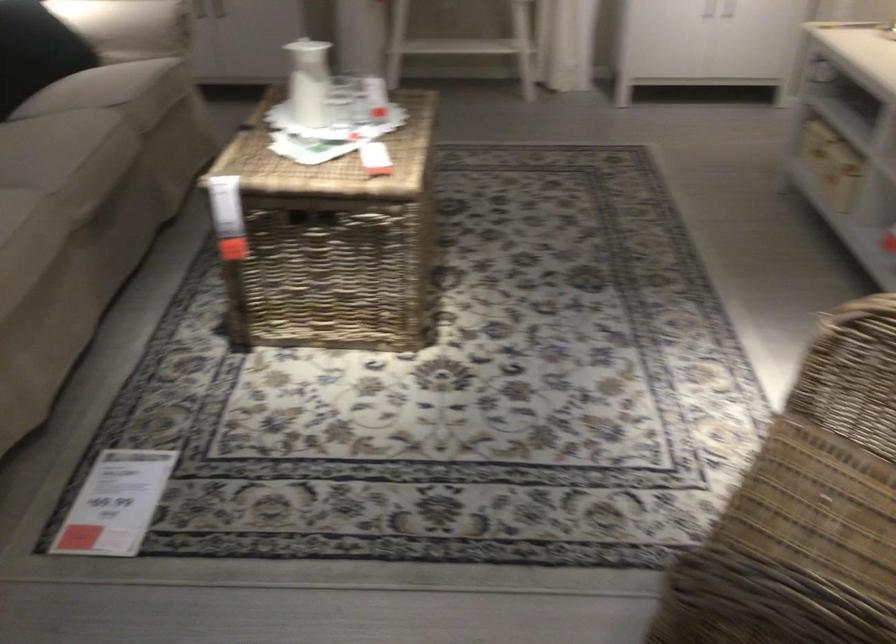
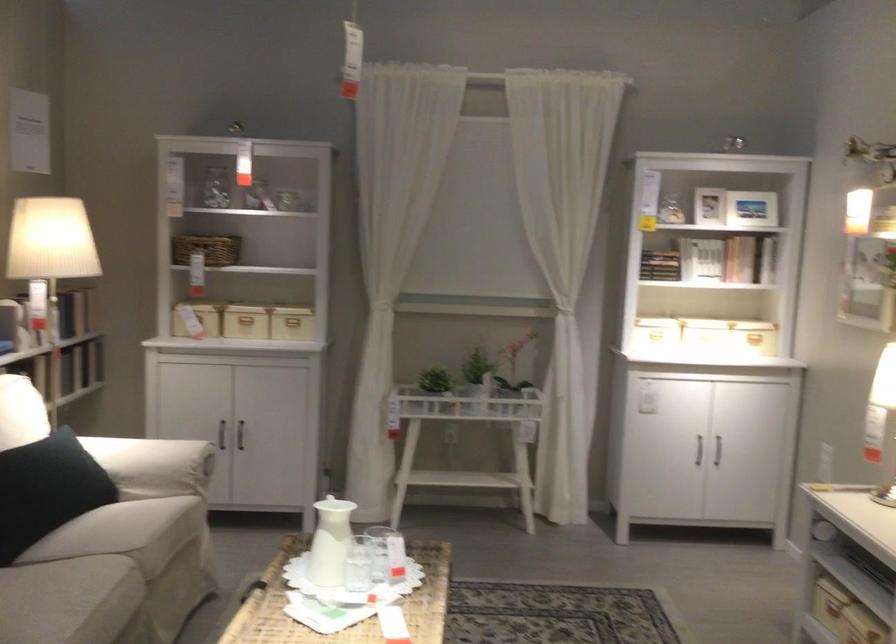
Find the pixel in the second image that matches point 101,122 in the first image.

(110, 576)